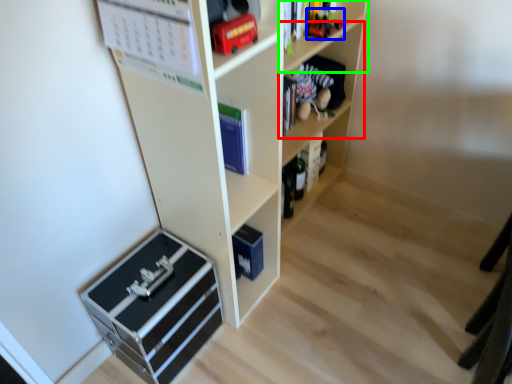
Question: Estimate the real-world distances between objects in this image. Which object is farther from shelf (highlighted by a red box), toy (highlighted by a blue box) or shelf (highlighted by a green box)?

Choices:
 (A) toy
 (B) shelf

Answer: (A)